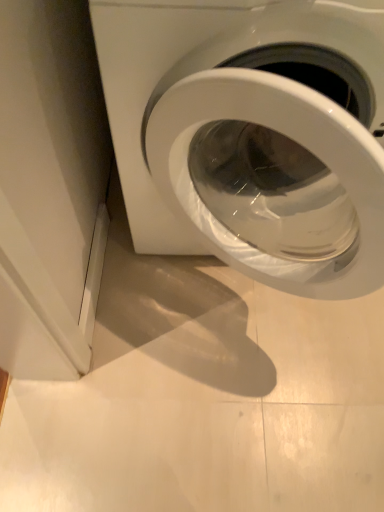
At what (x,y) coordinates should I click in order to perform the action: click on vacant space in front of white glossy washing machine at center. Please return your answer as a coordinate pair (x, y). This screenshot has width=384, height=512. Looking at the image, I should click on (208, 428).